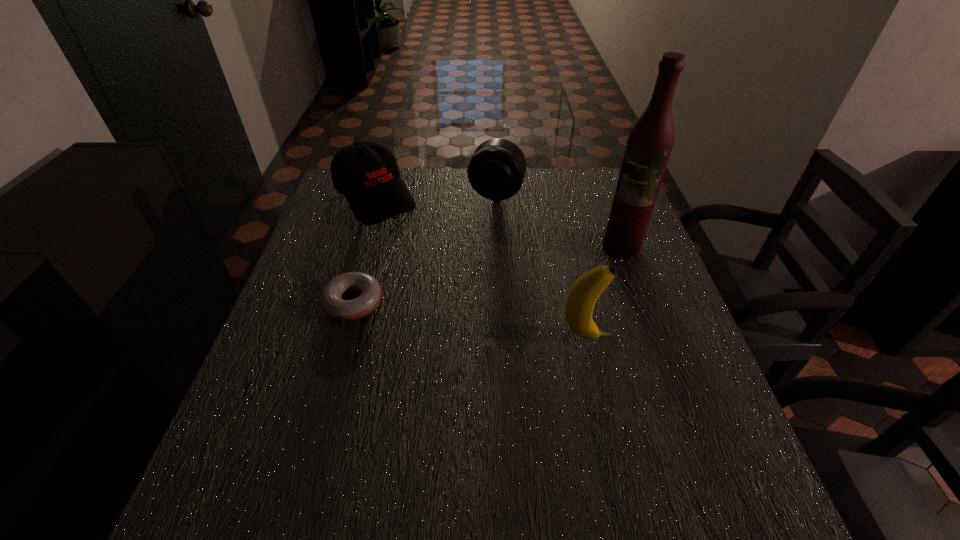
I want to click on vacant space on the desktop that is between the shortest object and the fourth object from left to right and is positioned on the front-facing side of the baseball cap, so click(x=490, y=323).

The width and height of the screenshot is (960, 540). I want to click on free space on the desktop that is between the doughnut and the second object from right to left and is positioned on the front-facing side of the telephoto lens, so click(x=451, y=317).

Locate an element on the screen. free spot on the desktop that is between the shortest object and the second tallest object and is positioned on the label of the rightmost object is located at coordinates (482, 322).